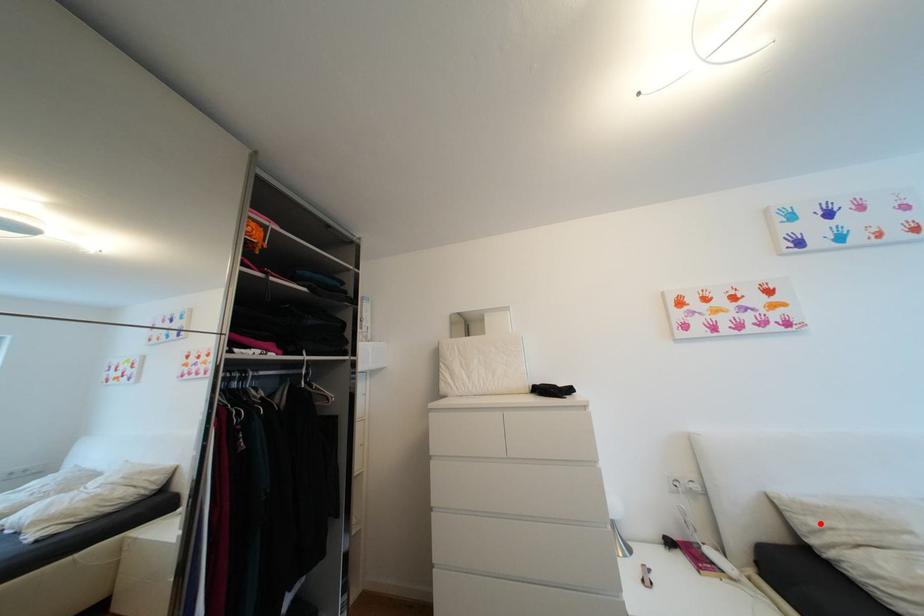
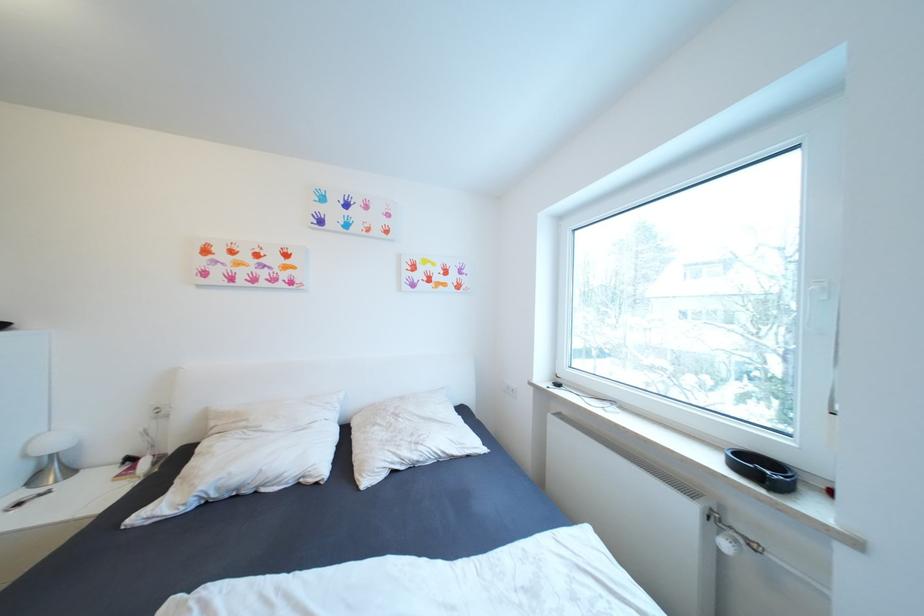
Question: I am providing you with two images of the same scene from different viewpoints. Given a red point in image1, look at the same physical point in image2. Is it:

Choices:
 (A) Closer to the viewpoint
 (B) Farther from the viewpoint

Answer: (B)